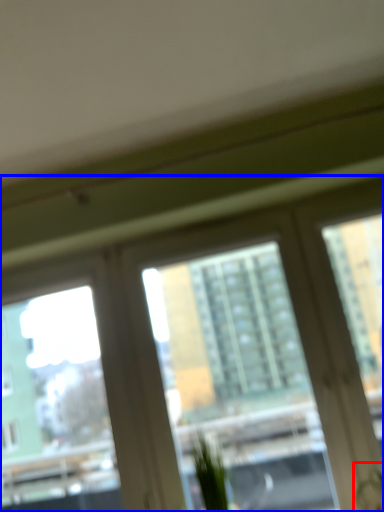
Question: Which object appears farthest to the camera in this image, plant (highlighted by a red box) or window (highlighted by a blue box)?

Choices:
 (A) plant
 (B) window

Answer: (B)